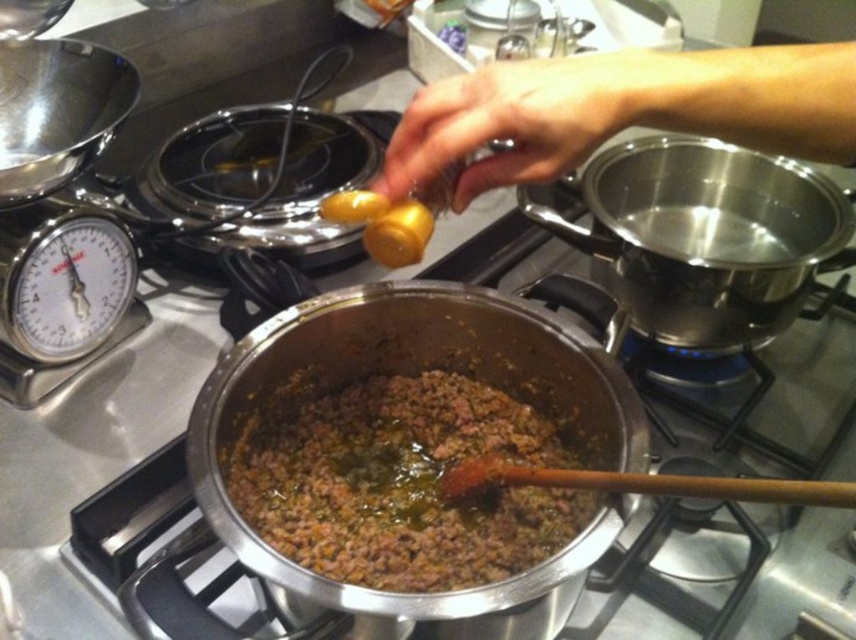
What are the coordinates of the brown matte ground meat at center?

The brown matte ground meat at center is located at coordinates point (397, 481).

In the cooking scene, you see the brown matte ground meat at center and the smooth yellow mustard at upper center. Which one is positioned to the left?

The brown matte ground meat at center is to the left of the smooth yellow mustard at upper center.